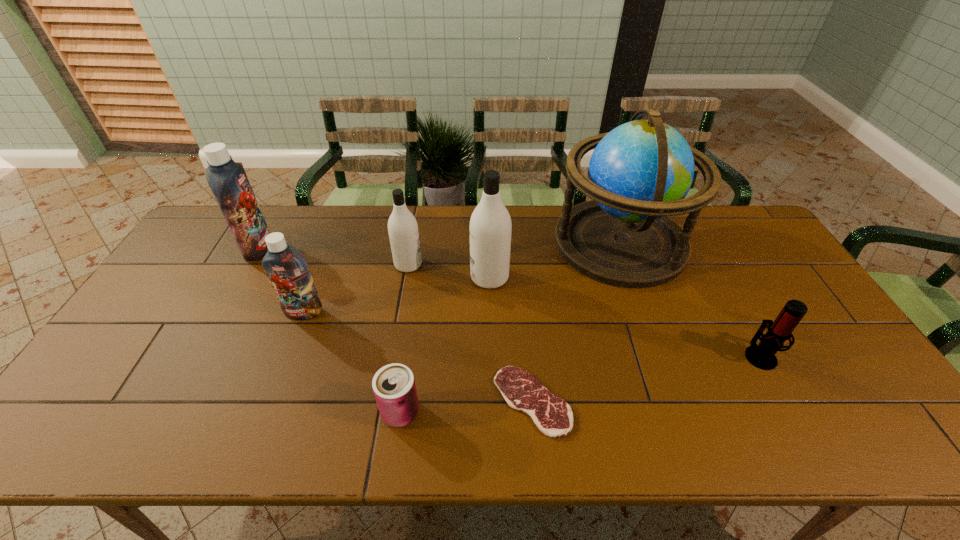
Locate an element on the screen. The width and height of the screenshot is (960, 540). free space located on the front-facing side of the third shampoo from left to right is located at coordinates (534, 265).

Find the location of `vacant region located on the front label of the second shampoo from left to right`. vacant region located on the front label of the second shampoo from left to right is located at coordinates (277, 380).

Locate an element on the screen. The width and height of the screenshot is (960, 540). vacant space located 0.150m on the back of the microphone is located at coordinates (729, 300).

Locate an element on the screen. Image resolution: width=960 pixels, height=540 pixels. free location located 0.240m on the right of the can is located at coordinates (523, 412).

You are a GUI agent. You are given a task and a screenshot of the screen. Output one action in this format:
    pyautogui.click(x=<x>, y=<y>)
    Task: Click on the free space located 0.100m on the left of the shortest object
    The width and height of the screenshot is (960, 540).
    Given the screenshot: What is the action you would take?
    pyautogui.click(x=452, y=401)

This screenshot has height=540, width=960. I want to click on globe situated at the far edge, so click(x=639, y=173).

At what (x,y) coordinates should I click in order to perform the action: click on shampoo at the far edge. Please return your answer as a coordinate pair (x, y). The height and width of the screenshot is (540, 960). Looking at the image, I should click on (228, 181).

Where is `can that is at the near edge`? The image size is (960, 540). can that is at the near edge is located at coordinates (394, 387).

Locate an element on the screen. The width and height of the screenshot is (960, 540). steak positioned at the near edge is located at coordinates (553, 416).

Identify the location of vacant space at the far edge of the desktop. Image resolution: width=960 pixels, height=540 pixels. [353, 244].